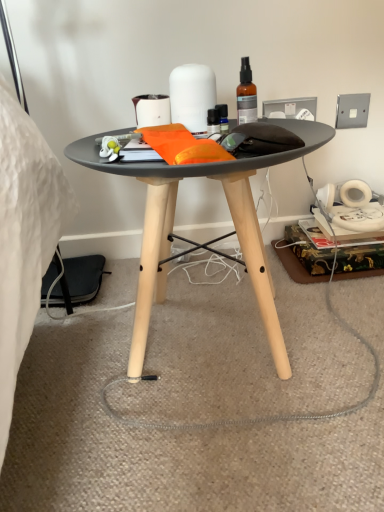
Where is `free point below matte black table at center (from a real-world perspective)`? Image resolution: width=384 pixels, height=512 pixels. free point below matte black table at center (from a real-world perspective) is located at coordinates (205, 343).